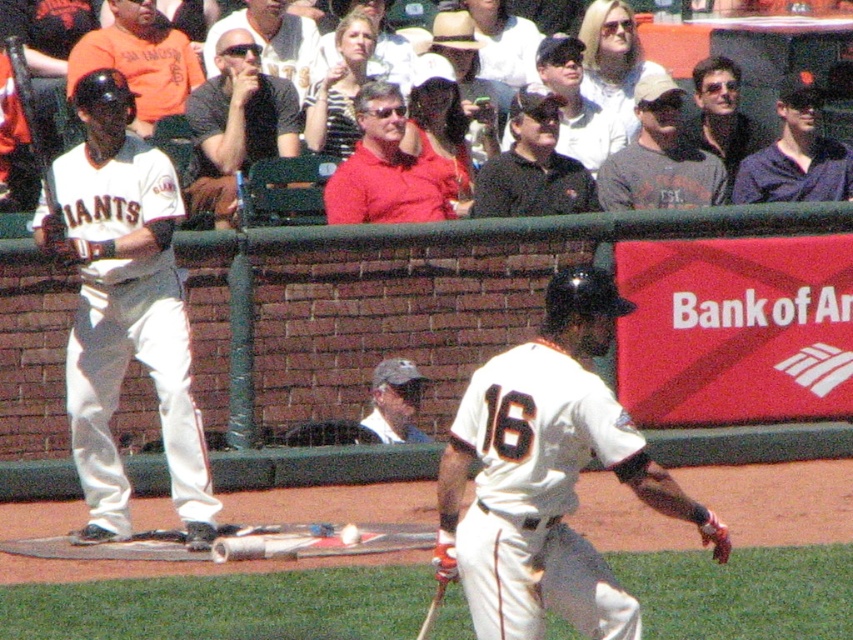
You are a photographer at the baseball game and want to take a picture of both the orange jersey at left and the shiny black sunglasses at upper right in the same frame. Based on their positions, which object should you adjust your camera to focus on first to ensure both are in the shot?

The orange jersey at left is to the left of shiny black sunglasses at upper right, so you should focus on the shiny black sunglasses at upper right first to ensure both are in the frame.

You are a photographer at the baseball game. You want to take a photo that includes both the white matte uniform at left and the matte black sunglasses at upper center. Based on their sizes in the image, which object should you focus on first to ensure both are in frame?

The white matte uniform at left is taller than the matte black sunglasses at upper center, so you should focus on the white matte uniform at left first to ensure both are in frame since it is larger and will require more space.